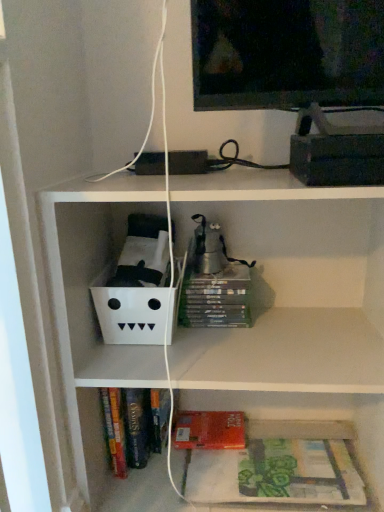
The image size is (384, 512). Find the location of `free spot above green matte book at lower right (from a real-world perspective)`. free spot above green matte book at lower right (from a real-world perspective) is located at coordinates (311, 454).